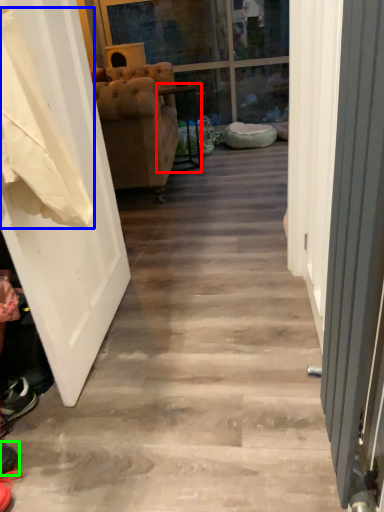
Question: Which object is positioned farthest from furniture (highlighted by a red box)? Select from laundry (highlighted by a blue box) and footwear (highlighted by a green box).

Choices:
 (A) laundry
 (B) footwear

Answer: (B)